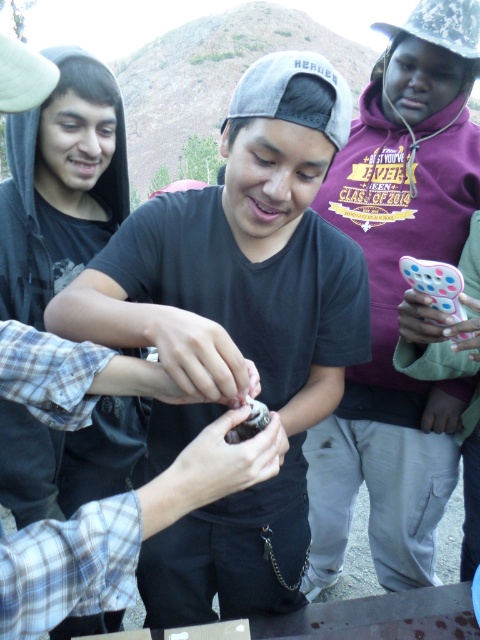
Can you confirm if black matte shirt at center is shorter than matte black phone at center?

Yes, black matte shirt at center is shorter than matte black phone at center.

Is point (172, 292) positioned before point (453, 259)?

Yes, it is in front of point (453, 259).

Identify the location of black matte shirt at center. (240, 323).

Which is more to the left, matte black phone at center or spongy white bread at center?

spongy white bread at center is more to the left.

Does point (384, 52) lie in front of point (230, 432)?

No.

I want to click on matte black phone at center, so click(398, 298).

In the scene shown: Is black matte shirt at center closer to camera compared to spongy white bread at center?

Yes, it is.

Which is in front, point (193, 260) or point (251, 429)?

Positioned in front is point (251, 429).

Find the location of a particular element. This screenshot has height=640, width=480. black matte shirt at center is located at coordinates (240, 323).